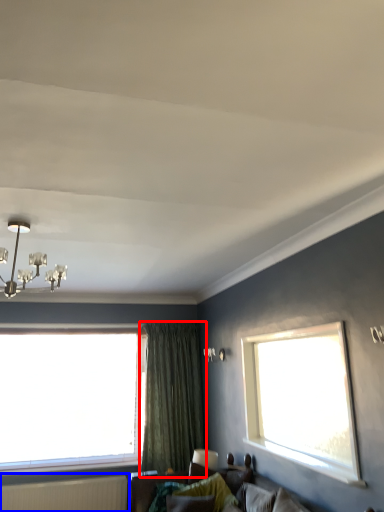
Question: Which of the following is the farthest to the observer, curtain (highlighted by a red box) or radiator (highlighted by a blue box)?

Choices:
 (A) curtain
 (B) radiator

Answer: (A)